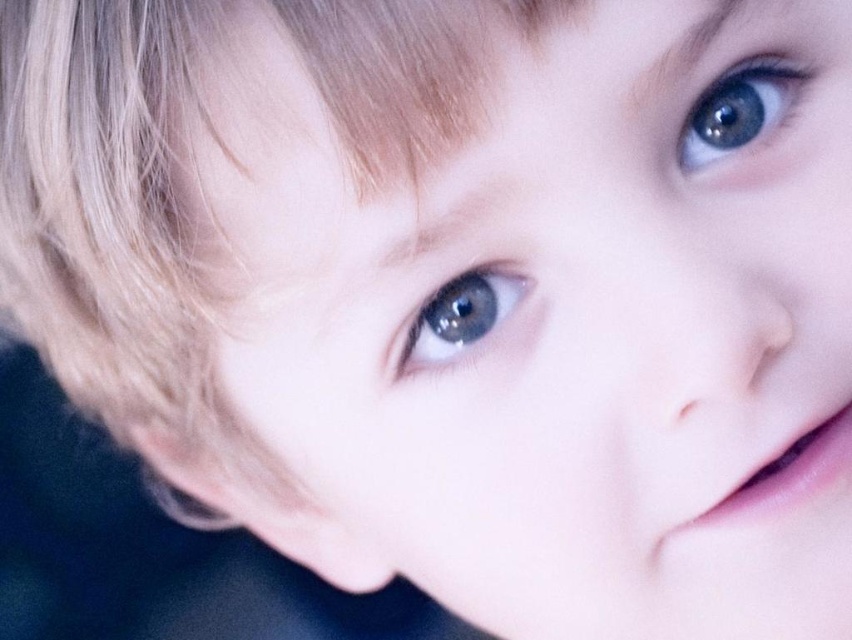
Is blue glossy eye at upper center to the left of blue glossy eye at center from the viewer's perspective?

No, blue glossy eye at upper center is not to the left of blue glossy eye at center.

Does point (750, 65) come closer to viewer compared to point (435, 314)?

No, (750, 65) is behind (435, 314).

This screenshot has width=852, height=640. Find the location of `blue glossy eye at upper center`. blue glossy eye at upper center is located at coordinates (738, 113).